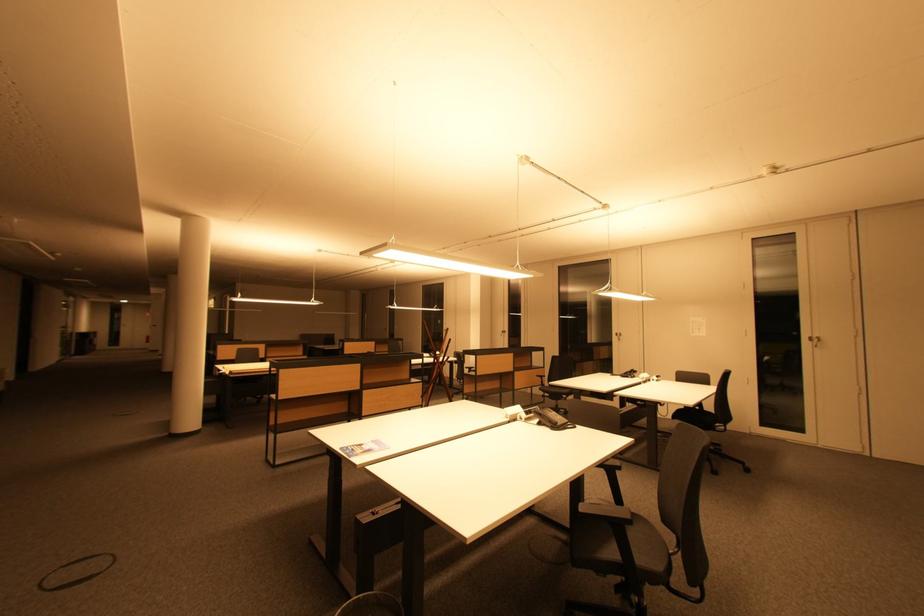
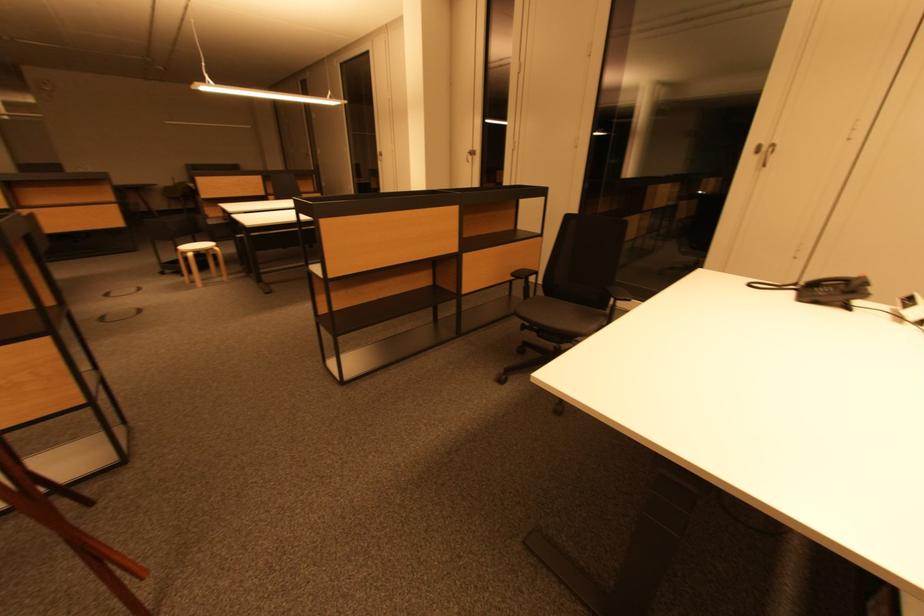
Locate, in the second image, the point that corresponds to pixel 520 376 in the first image.

(470, 259)